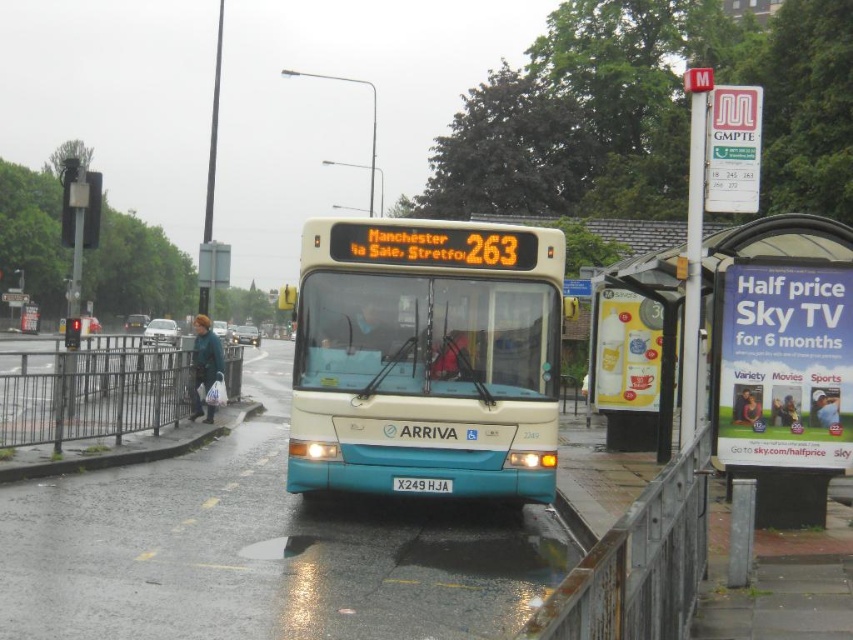
Who is higher up, teal matte bus at center or gray concrete curb at lower left?

teal matte bus at center is above.

Does teal matte bus at center appear on the left side of gray concrete curb at lower left?

In fact, teal matte bus at center is to the right of gray concrete curb at lower left.

Does point (387, 413) come farther from viewer compared to point (144, 458)?

That is False.

You are a GUI agent. You are given a task and a screenshot of the screen. Output one action in this format:
    pyautogui.click(x=<x>, y=<y>)
    Task: Click on the teal matte bus at center
    The image size is (853, 640).
    Given the screenshot: What is the action you would take?
    pyautogui.click(x=425, y=358)